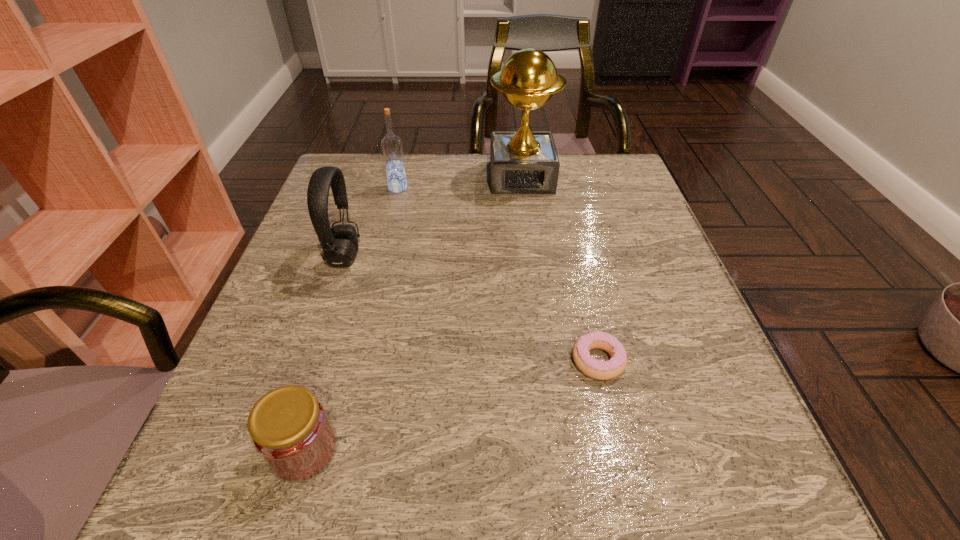
At what (x,y) coordinates should I click in order to perform the action: click on vacant space situated on the right of the nearest object. Please return your answer as a coordinate pair (x, y). The image size is (960, 540). Looking at the image, I should click on (509, 450).

What are the coordinates of `free location located on the back of the doughnut` in the screenshot? It's located at (563, 208).

Identify the location of award that is at the far edge. pos(524,162).

Identify the location of vodka present at the far edge. Image resolution: width=960 pixels, height=540 pixels. (391, 145).

Locate an element on the screen. object situated at the near edge is located at coordinates (289, 427).

In order to click on headset at the left edge in this screenshot , I will do `click(339, 243)`.

Identify the location of jam that is positioned at the left edge. This screenshot has width=960, height=540. (289, 427).

At what (x,y) coordinates should I click in order to perform the action: click on object at the right edge. Please return your answer as a coordinate pair (x, y). Looking at the image, I should click on (601, 370).

The height and width of the screenshot is (540, 960). I want to click on object located in the near left corner section of the desktop, so click(289, 427).

You are a GUI agent. You are given a task and a screenshot of the screen. Output one action in this format:
    pyautogui.click(x=<x>, y=<y>)
    Task: Click on the blank area at the far edge
    The width and height of the screenshot is (960, 540).
    Given the screenshot: What is the action you would take?
    pyautogui.click(x=391, y=198)